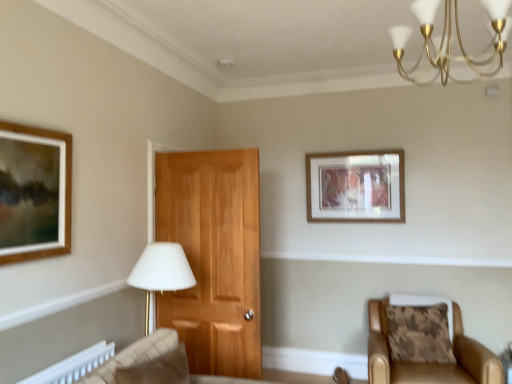
Question: Is gold metallic chandelier at upper right not within leather armchair at lower right?

Choices:
 (A) yes
 (B) no

Answer: (A)

Question: Considering the relative positions of gold metallic chandelier at upper right and leather armchair at lower right in the image provided, is gold metallic chandelier at upper right in front of leather armchair at lower right?

Choices:
 (A) yes
 (B) no

Answer: (A)

Question: Is gold metallic chandelier at upper right smaller than leather armchair at lower right?

Choices:
 (A) no
 (B) yes

Answer: (B)

Question: Does gold metallic chandelier at upper right have a greater height compared to leather armchair at lower right?

Choices:
 (A) yes
 (B) no

Answer: (B)

Question: Is gold metallic chandelier at upper right far away from leather armchair at lower right?

Choices:
 (A) no
 (B) yes

Answer: (B)

Question: Does gold metallic chandelier at upper right appear on the right side of leather armchair at lower right?

Choices:
 (A) no
 (B) yes

Answer: (A)

Question: From a real-world perspective, is leather armchair at lower right physically below wooden picture frame at upper center?

Choices:
 (A) no
 (B) yes

Answer: (B)

Question: Is the position of leather armchair at lower right more distant than that of wooden picture frame at upper center?

Choices:
 (A) no
 (B) yes

Answer: (A)

Question: Considering the relative sizes of leather armchair at lower right and wooden picture frame at upper center in the image provided, is leather armchair at lower right bigger than wooden picture frame at upper center?

Choices:
 (A) yes
 (B) no

Answer: (A)

Question: Would you say leather armchair at lower right is outside wooden picture frame at upper center?

Choices:
 (A) no
 (B) yes

Answer: (B)

Question: Considering the relative positions of leather armchair at lower right and wooden picture frame at upper center in the image provided, is leather armchair at lower right to the right of wooden picture frame at upper center from the viewer's perspective?

Choices:
 (A) no
 (B) yes

Answer: (B)

Question: From a real-world perspective, is leather armchair at lower right positioned over wooden picture frame at upper center based on gravity?

Choices:
 (A) yes
 (B) no

Answer: (B)

Question: Is wooden picture frame at upper center positioned before gold metallic chandelier at upper right?

Choices:
 (A) no
 (B) yes

Answer: (A)